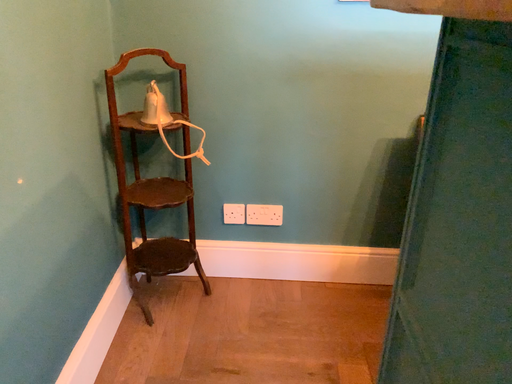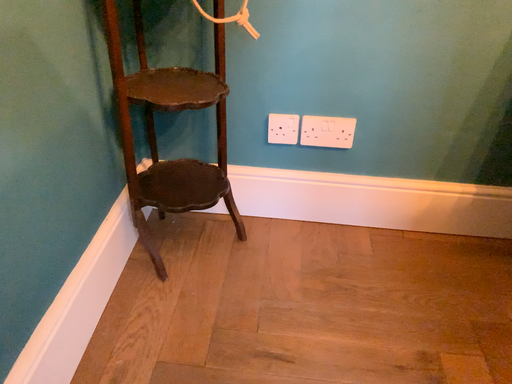
Question: Which way did the camera rotate in the video?

Choices:
 (A) rotated downward
 (B) rotated upward

Answer: (A)